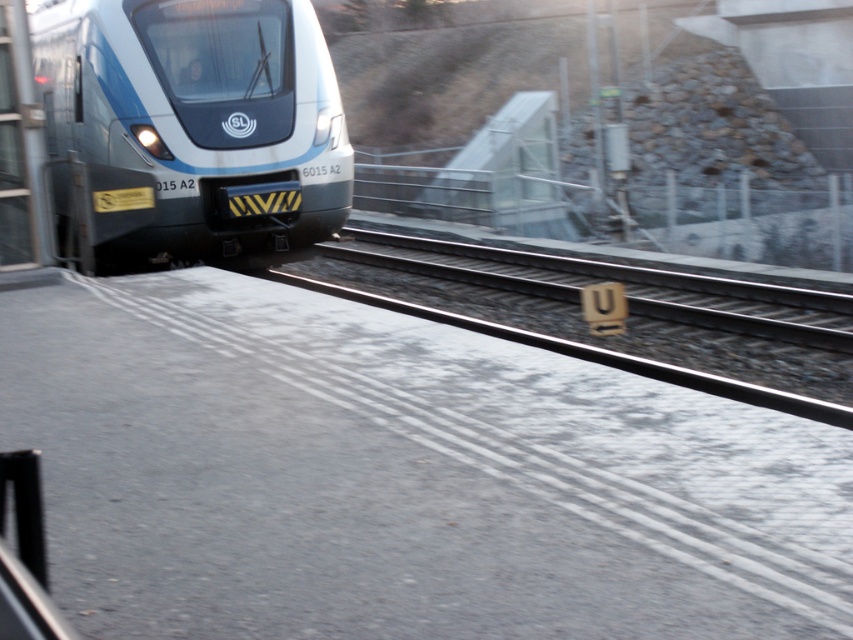
You are a maintenance worker assessing the clearance height between the metallic silver train at left and the smooth concrete train track at center. Based on the scene, which object has a greater height?

The smooth concrete train track at center is taller than the metallic silver train at left.

You are a maintenance worker checking the width of the metallic silver train at left and the smooth concrete train track at center. Which object has a smaller width?

The metallic silver train at left is thinner than the smooth concrete train track at center, so the metallic silver train at left has a smaller width.